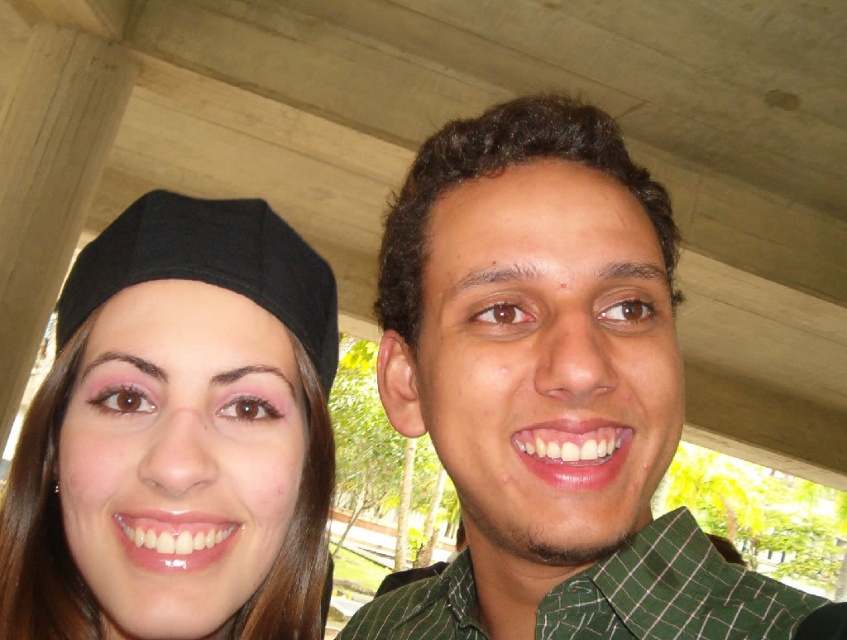
Question: Which point appears farthest from the camera in this image?

Choices:
 (A) (206, 618)
 (B) (479, 513)
 (C) (463, 612)

Answer: (C)

Question: From the image, what is the correct spatial relationship of green checkered shirt at center in relation to green checkered shirt at right?

Choices:
 (A) above
 (B) below

Answer: (A)

Question: Which point is closer to the camera taking this photo?

Choices:
 (A) (257, 275)
 (B) (552, 548)
 (C) (562, 588)

Answer: (B)

Question: Does green checkered shirt at center appear over matte black cap at left?

Choices:
 (A) no
 (B) yes

Answer: (B)

Question: Which object is positioned closest to the green checkered shirt at right?

Choices:
 (A) green checkered shirt at center
 (B) matte black cap at left

Answer: (A)

Question: Observing the image, what is the correct spatial positioning of matte black cap at left in reference to green checkered shirt at right?

Choices:
 (A) above
 (B) below

Answer: (A)